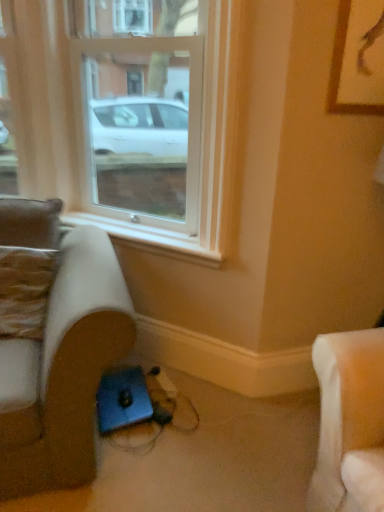
Question: Is leather-like brown pillow at left thinner than suede-like beige studio couch at lower left?

Choices:
 (A) no
 (B) yes

Answer: (B)

Question: Is leather-like brown pillow at left smaller than suede-like beige studio couch at lower left?

Choices:
 (A) yes
 (B) no

Answer: (A)

Question: Are leather-like brown pillow at left and suede-like beige studio couch at lower left beside each other?

Choices:
 (A) yes
 (B) no

Answer: (B)

Question: Is leather-like brown pillow at left in front of suede-like beige studio couch at lower left?

Choices:
 (A) no
 (B) yes

Answer: (A)

Question: From the image's perspective, is leather-like brown pillow at left under suede-like beige studio couch at lower left?

Choices:
 (A) no
 (B) yes

Answer: (A)

Question: Does leather-like brown pillow at left have a lesser height compared to suede-like beige studio couch at lower left?

Choices:
 (A) yes
 (B) no

Answer: (A)

Question: Is wooden framed picture at upper right shorter than clear glass window at center?

Choices:
 (A) no
 (B) yes

Answer: (B)

Question: Considering the relative sizes of wooden framed picture at upper right and clear glass window at center in the image provided, is wooden framed picture at upper right wider than clear glass window at center?

Choices:
 (A) yes
 (B) no

Answer: (B)

Question: Considering the relative positions of wooden framed picture at upper right and clear glass window at center in the image provided, is wooden framed picture at upper right to the left of clear glass window at center from the viewer's perspective?

Choices:
 (A) no
 (B) yes

Answer: (A)

Question: Can you confirm if wooden framed picture at upper right is smaller than clear glass window at center?

Choices:
 (A) no
 (B) yes

Answer: (B)

Question: Is wooden framed picture at upper right at the right side of clear glass window at center?

Choices:
 (A) no
 (B) yes

Answer: (B)

Question: Does wooden framed picture at upper right have a greater height compared to clear glass window at center?

Choices:
 (A) yes
 (B) no

Answer: (B)

Question: From the image's perspective, is clear glass window at center above suede-like beige studio couch at lower left?

Choices:
 (A) yes
 (B) no

Answer: (A)